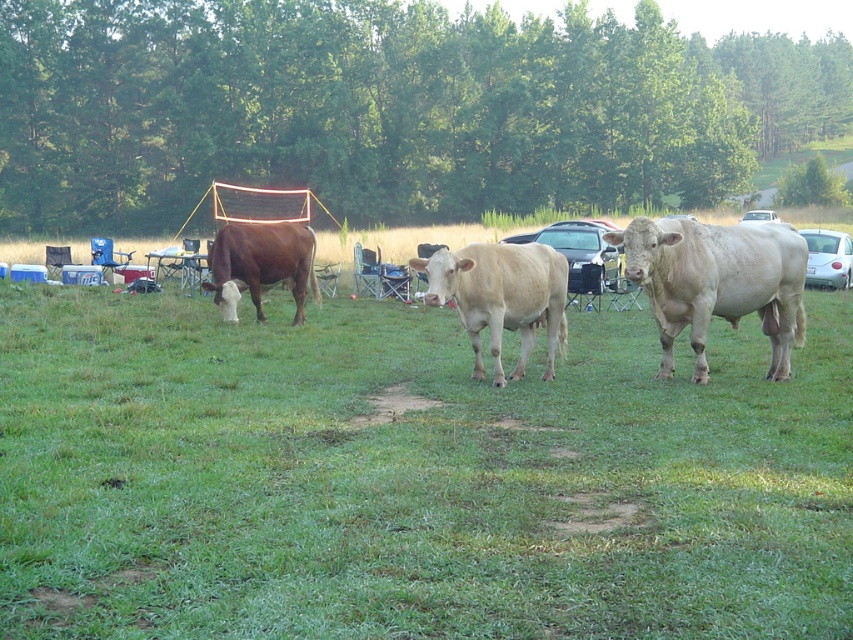
How distant is light beige smooth cow at center from white glossy car at center?

light beige smooth cow at center and white glossy car at center are 11.90 meters apart from each other.

Does light beige smooth cow at center have a smaller size compared to white glossy car at center?

Correct, light beige smooth cow at center occupies less space than white glossy car at center.

You are a GUI agent. You are given a task and a screenshot of the screen. Output one action in this format:
    pyautogui.click(x=<x>, y=<y>)
    Task: Click on the light beige smooth cow at center
    Image resolution: width=853 pixels, height=640 pixels.
    Given the screenshot: What is the action you would take?
    pyautogui.click(x=502, y=298)

Where is `light beige smooth cow at center`? light beige smooth cow at center is located at coordinates (502, 298).

Is white smooth bull at right below light beige smooth cow at center?

No.

Is point (660, 371) positioned before point (500, 268)?

That is False.

I want to click on white smooth bull at right, so click(717, 282).

Based on the photo, does white glossy car at right come in front of white glossy car at center?

Yes, it is.

Who is more distant from viewer, [834,269] or [749,211]?

The point [749,211] is behind.

What do you see at coordinates (827, 259) in the screenshot? I see `white glossy car at right` at bounding box center [827, 259].

I want to click on white glossy car at right, so click(827, 259).